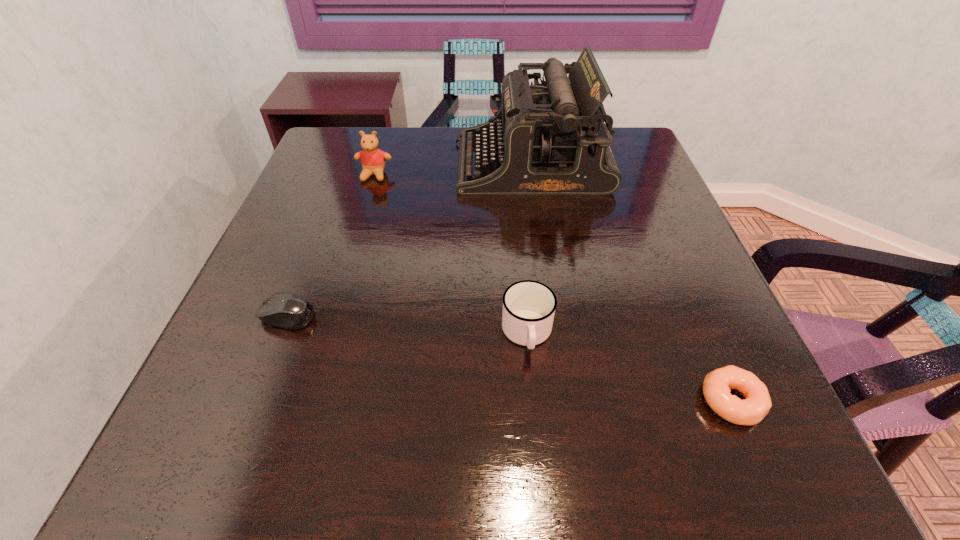
In order to click on vacant area in the image that satisfies the following two spatial constraints: 1. on the keyboard of the typewriter; 2. on the left side of the nearest object in this screenshot , I will do `click(566, 401)`.

Find the location of a particular element. The height and width of the screenshot is (540, 960). vacant area that satisfies the following two spatial constraints: 1. on the keyboard of the tallest object; 2. on the side of the mug with the handle is located at coordinates (556, 333).

This screenshot has height=540, width=960. Find the location of `free space that satisfies the following two spatial constraints: 1. on the back side of the rightmost object; 2. on the keyboard of the tallest object`. free space that satisfies the following two spatial constraints: 1. on the back side of the rightmost object; 2. on the keyboard of the tallest object is located at coordinates (629, 164).

Where is `free spot that satisfies the following two spatial constraints: 1. on the keyboard of the typewriter; 2. on the left side of the doughnut`? The width and height of the screenshot is (960, 540). free spot that satisfies the following two spatial constraints: 1. on the keyboard of the typewriter; 2. on the left side of the doughnut is located at coordinates (566, 401).

At what (x,y) coordinates should I click in order to perform the action: click on free spot that satisfies the following two spatial constraints: 1. on the keyboard of the tallest object; 2. on the side of the mug with the handle. Please return your answer as a coordinate pair (x, y). The height and width of the screenshot is (540, 960). Looking at the image, I should click on [x=556, y=333].

Locate an element on the screen. vacant space that satisfies the following two spatial constraints: 1. on the keyboard of the typewriter; 2. on the right side of the nearest object is located at coordinates (566, 401).